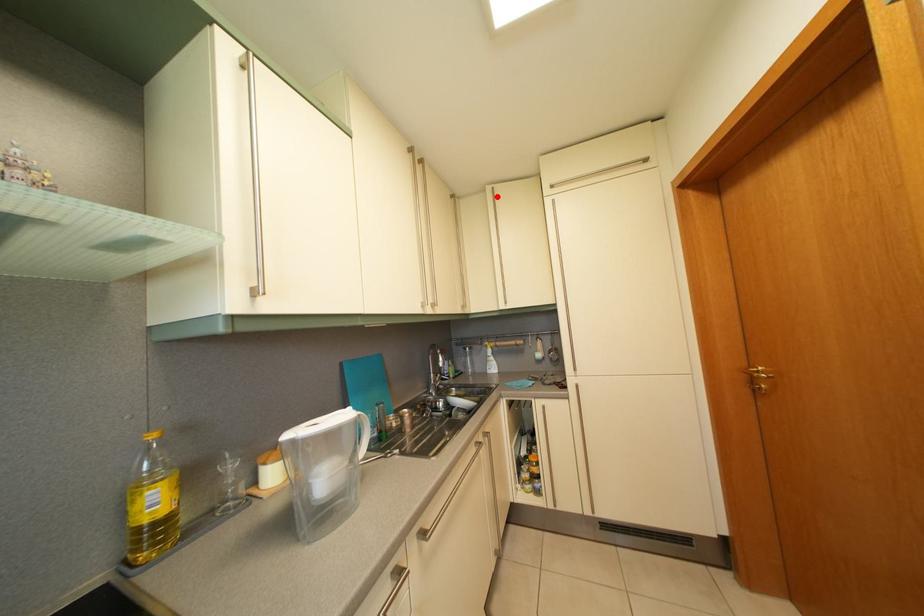
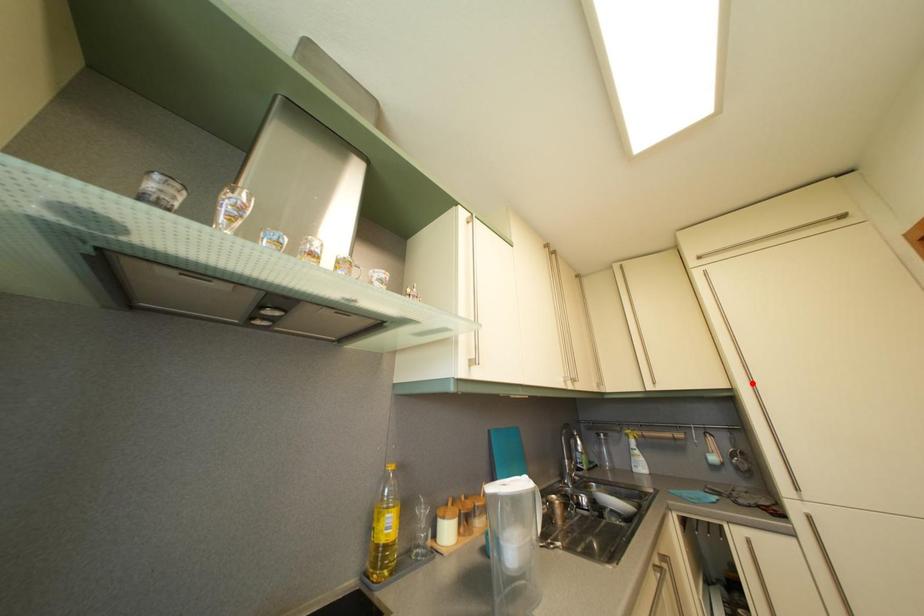
I am providing you with two images of the same scene from different viewpoints. A red point is marked on the first image and another point is marked on the second image. Are the points marked in image1 and image2 representing the same 3D position?

No